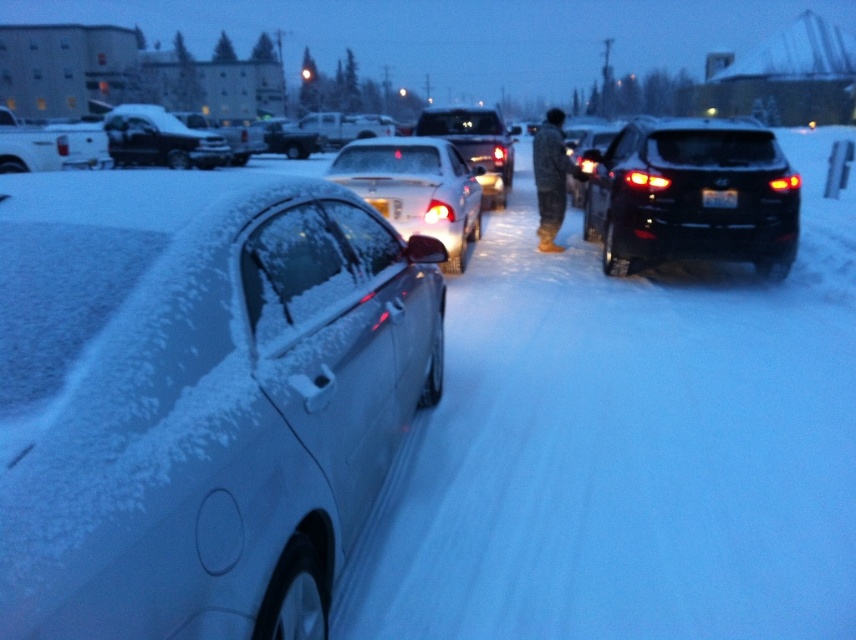
You are a delivery person trying to park your van between the white matte car at left and the white glossy sedan at center. Based on their sizes, which car should you position your van closer to?

Since the white matte car at left is smaller than the white glossy sedan at center, you should position your van closer to the white matte car at left to ensure enough space for parking.

You are a delivery person who needs to park your van between the white matte car at left and the white glossy sedan at center. Your van is 4 meters long. Can you fit your van between them without hitting either vehicle?

The distance between the white matte car at left and the white glossy sedan at center is 4.64 meters. Since your van is 4 meters long, there is enough space to park between them without hitting either vehicle.